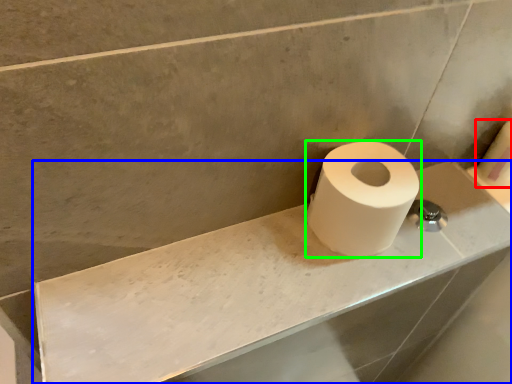
Question: Which object is the farthest from toilet paper (highlighted by a red box)? Choose among these: counter top (highlighted by a blue box) or toilet paper (highlighted by a green box).

Choices:
 (A) counter top
 (B) toilet paper

Answer: (A)